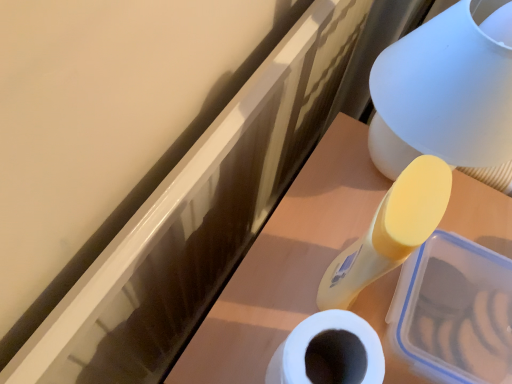
Question: Looking at their shapes, would you say white matte toilet paper at lower center is wider or thinner than translucent plastic container at upper right?

Choices:
 (A) wide
 (B) thin

Answer: (B)

Question: Considering their positions, is white matte toilet paper at lower center located in front of or behind translucent plastic container at upper right?

Choices:
 (A) front
 (B) behind

Answer: (A)

Question: Considering the real-world distances, which object is farthest from the white matte toilet paper at lower center?

Choices:
 (A) translucent plastic container at upper right
 (B) matte white table lamp at upper right

Answer: (B)

Question: Which object is the closest to the matte white table lamp at upper right?

Choices:
 (A) white matte toilet paper at lower center
 (B) translucent plastic container at upper right

Answer: (B)